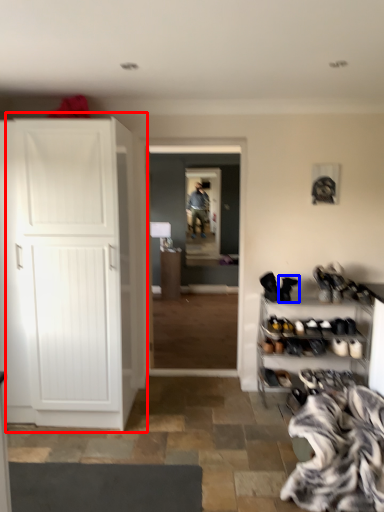
Question: Among these objects, which one is nearest to the camera, cupboard (highlighted by a red box) or footwear (highlighted by a blue box)?

Choices:
 (A) cupboard
 (B) footwear

Answer: (A)